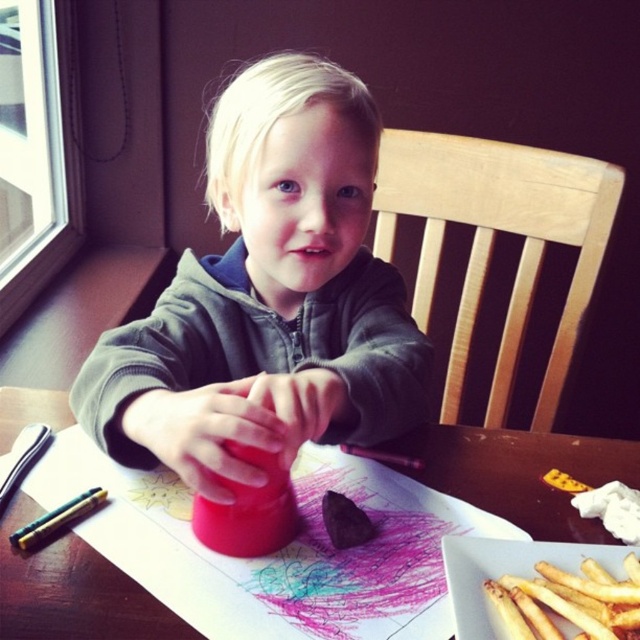
Question: Among these points, which one is farthest from the camera?

Choices:
 (A) (339, 90)
 (B) (48, 531)
 (C) (625, 564)

Answer: (A)

Question: Based on their relative distances, which object is nearer to the metallic silver pencil at lower left?

Choices:
 (A) white crispy fries at lower right
 (B) matte plastic table at center
 (C) matte plastic cup at center

Answer: (C)

Question: Does matte plastic cup at center have a greater width compared to white crispy fries at lower right?

Choices:
 (A) yes
 (B) no

Answer: (A)

Question: Which point is farther to the camera?

Choices:
 (A) matte plastic cup at center
 (B) matte plastic table at center
 (C) white crispy fries at lower right

Answer: (B)

Question: Observing the image, what is the correct spatial positioning of white crispy fries at lower right in reference to metallic silver pencil at lower left?

Choices:
 (A) above
 (B) below

Answer: (B)

Question: Can you confirm if matte plastic table at center is positioned above white crispy fries at lower right?

Choices:
 (A) yes
 (B) no

Answer: (A)